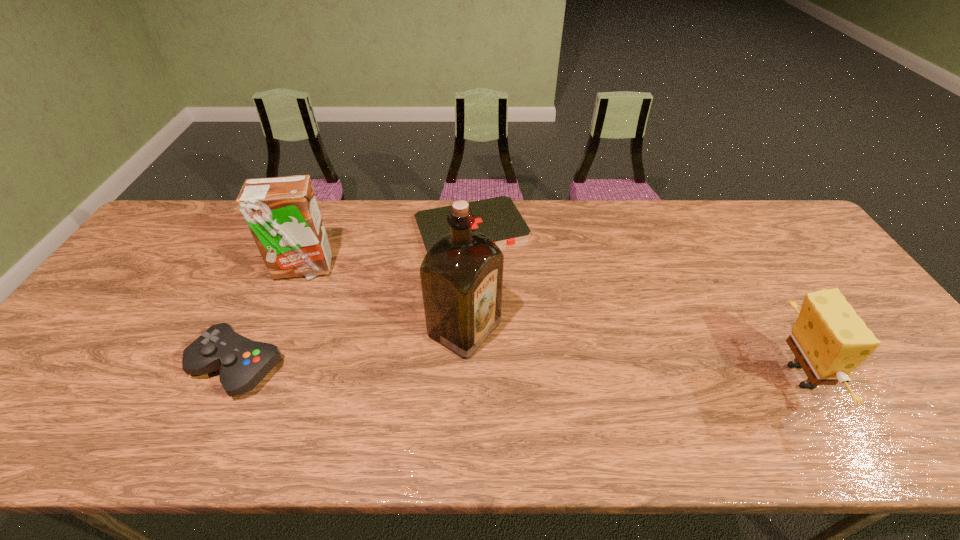
In order to click on vacant space in between the third shortest object and the shortest object in this screenshot , I will do `click(635, 302)`.

Locate an element on the screen. vacant space that is in between the carton and the third tallest object is located at coordinates (551, 322).

Where is `vacant space in between the control and the liquor`? The width and height of the screenshot is (960, 540). vacant space in between the control and the liquor is located at coordinates (351, 348).

Where is `blank region between the sponge and the fourth shortest object`? blank region between the sponge and the fourth shortest object is located at coordinates (x=551, y=322).

Identify which object is the fourth nearest to the fourth tallest object. Please provide its 2D coordinates. Your answer should be formatted as a tuple, i.e. [(x, y)], where the tuple contains the x and y coordinates of a point satisfying the conditions above.

[(829, 340)]

Image resolution: width=960 pixels, height=540 pixels. Find the location of `object that stands as the second closest to the carton`. object that stands as the second closest to the carton is located at coordinates (498, 218).

Locate an element on the screen. This screenshot has height=540, width=960. vacant area that satisfies the following two spatial constraints: 1. on the front side of the sponge; 2. on the face of the fourth tallest object is located at coordinates (233, 376).

Find the location of a particular element. vacant area that satisfies the following two spatial constraints: 1. on the front side of the carton; 2. on the face of the sponge is located at coordinates (259, 376).

Image resolution: width=960 pixels, height=540 pixels. Find the location of `vacant position in the image that satisfies the following two spatial constraints: 1. on the back side of the control; 2. on the right side of the tallest object`. vacant position in the image that satisfies the following two spatial constraints: 1. on the back side of the control; 2. on the right side of the tallest object is located at coordinates (254, 329).

Where is `vacant area that satisfies the following two spatial constraints: 1. on the front side of the third tallest object; 2. on the face of the control`? This screenshot has height=540, width=960. vacant area that satisfies the following two spatial constraints: 1. on the front side of the third tallest object; 2. on the face of the control is located at coordinates (233, 376).